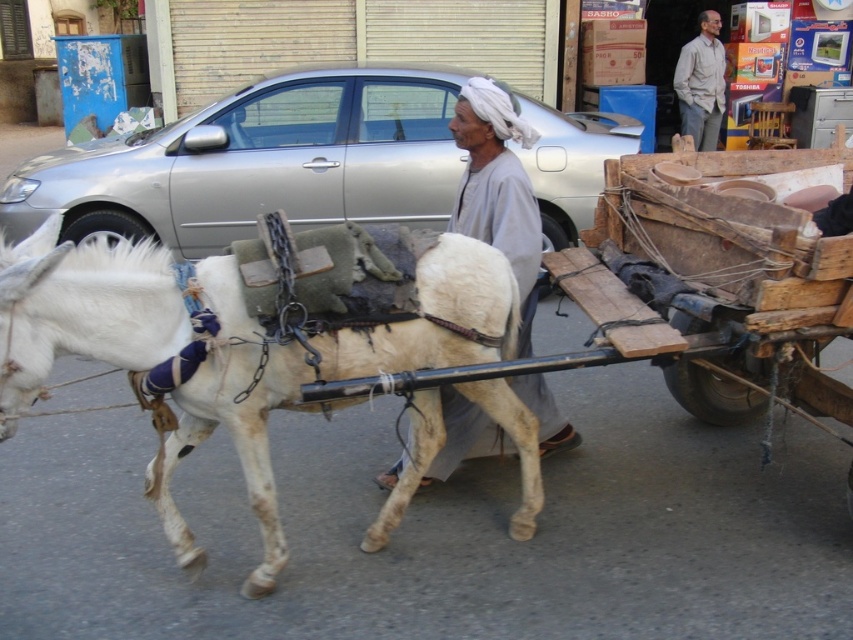
Can you confirm if silver metallic car at center is positioned to the right of gray cotton turban at center?

In fact, silver metallic car at center is to the left of gray cotton turban at center.

This screenshot has width=853, height=640. Find the location of `silver metallic car at center`. silver metallic car at center is located at coordinates (260, 163).

Does point (413, 161) lie in front of point (712, 12)?

Yes, it is.

Find the location of a particular element. This screenshot has width=853, height=640. silver metallic car at center is located at coordinates (260, 163).

Consider the image. Who is higher up, gray cotton turban at center or light gray shirt at upper right?

Positioned higher is light gray shirt at upper right.

Is gray cotton turban at center positioned in front of light gray shirt at upper right?

Yes.

Where is `gray cotton turban at center`? This screenshot has height=640, width=853. gray cotton turban at center is located at coordinates (497, 186).

Identify the location of gray cotton turban at center. (497, 186).